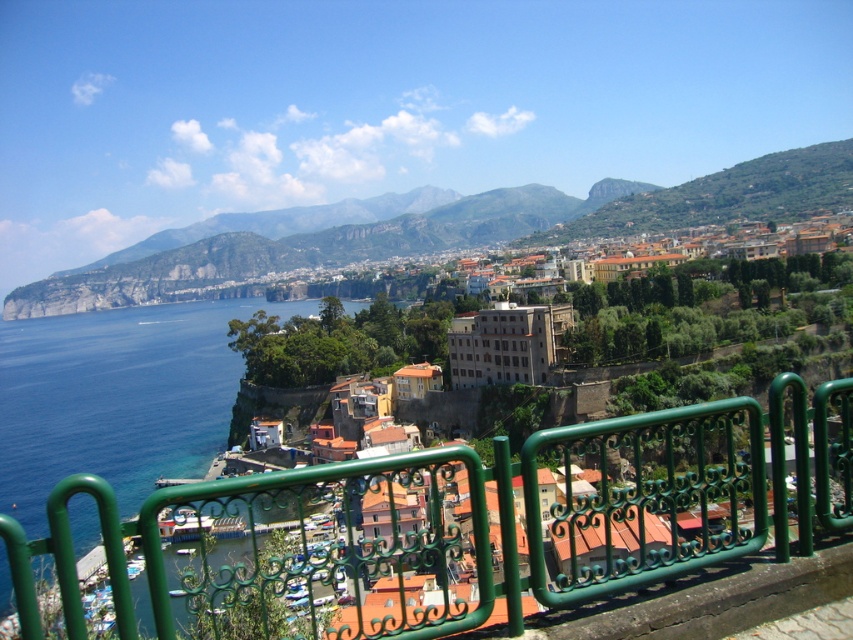
Does green wrought iron fence at center come behind blue water at lower left?

No, green wrought iron fence at center is in front of blue water at lower left.

Is green wrought iron fence at center to the left of blue water at lower left from the viewer's perspective?

No, green wrought iron fence at center is not to the left of blue water at lower left.

Which is behind, point (181, 509) or point (108, 337)?

The point (108, 337) is more distant.

The height and width of the screenshot is (640, 853). Identify the location of green wrought iron fence at center. (471, 522).